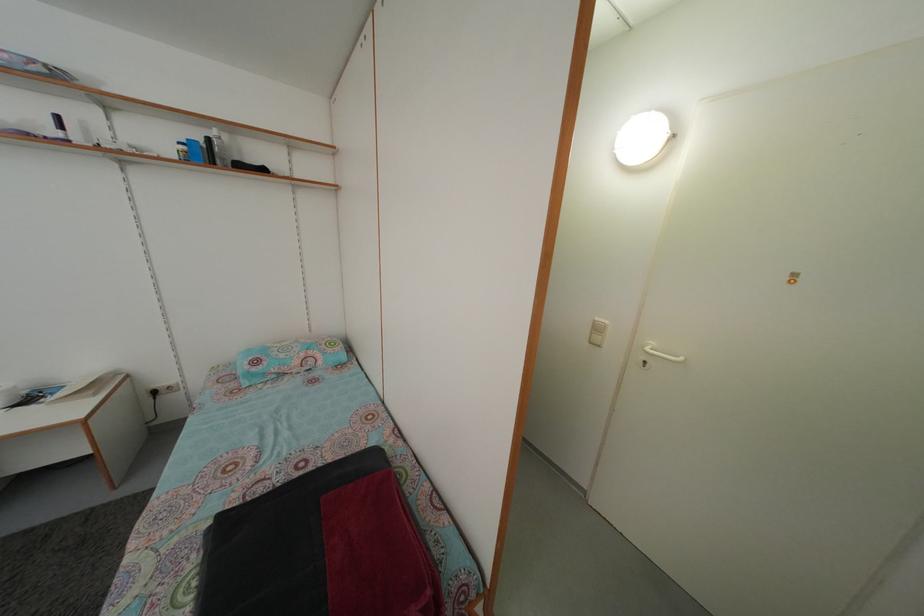
Which object does [249,167] point to?

It refers to a black bottle.